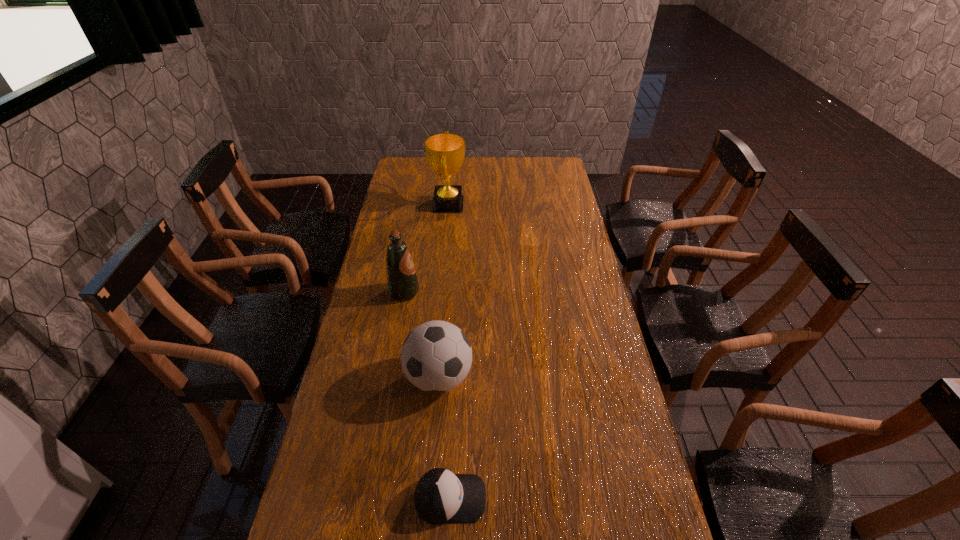
Find the location of `blank area in the image that satisfies the following two spatial constraints: 1. on the front-facing side of the third tallest object; 2. on the right side of the olive oil`. blank area in the image that satisfies the following two spatial constraints: 1. on the front-facing side of the third tallest object; 2. on the right side of the olive oil is located at coordinates pyautogui.click(x=389, y=377).

Where is `free space that satisfies the following two spatial constraints: 1. on the front-facing side of the soccer ball; 2. on the left side of the olive oil`? The width and height of the screenshot is (960, 540). free space that satisfies the following two spatial constraints: 1. on the front-facing side of the soccer ball; 2. on the left side of the olive oil is located at coordinates (389, 377).